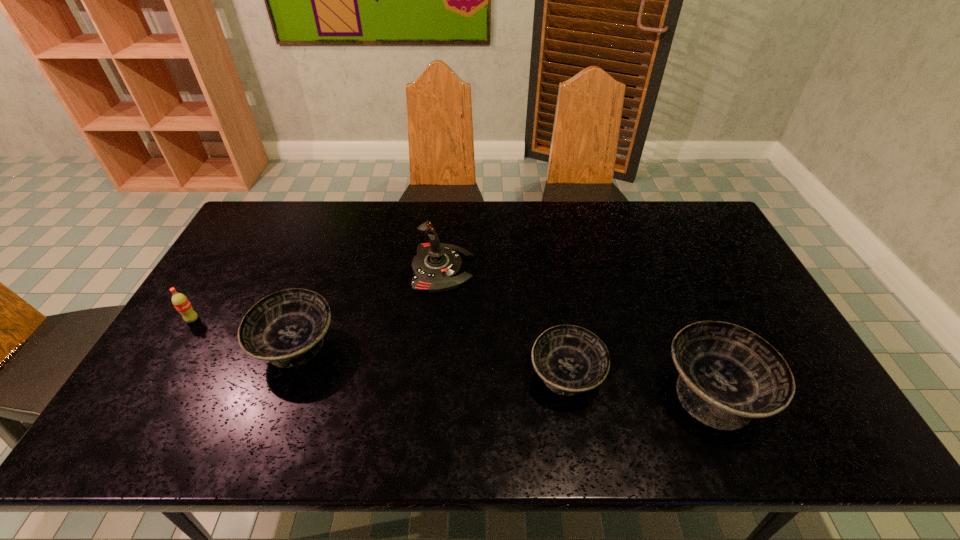
In order to click on vacant space that satisfies the following two spatial constraints: 1. on the handle side of the tallest object; 2. on the front side of the leftmost object in this screenshot , I will do `click(438, 320)`.